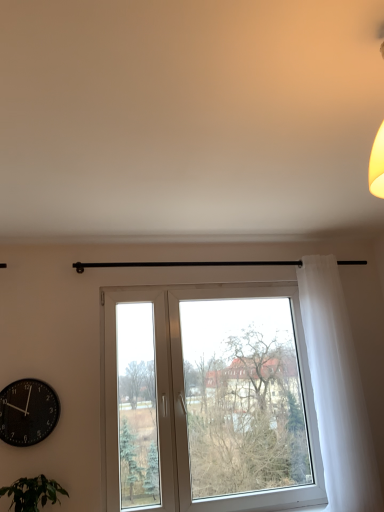
Question: Is white sheer curtain at right a part of white plastic window at center?

Choices:
 (A) yes
 (B) no

Answer: (B)

Question: From the image's perspective, would you say white plastic window at center is shown under white sheer curtain at right?

Choices:
 (A) yes
 (B) no

Answer: (A)

Question: Is white sheer curtain at right at the back of white plastic window at center?

Choices:
 (A) no
 (B) yes

Answer: (A)

Question: Is white plastic window at center facing towards white sheer curtain at right?

Choices:
 (A) yes
 (B) no

Answer: (A)

Question: Can you confirm if white plastic window at center is bigger than white sheer curtain at right?

Choices:
 (A) yes
 (B) no

Answer: (A)

Question: Is black matte wall clock at lower left bigger or smaller than white sheer curtain at right?

Choices:
 (A) small
 (B) big

Answer: (A)

Question: In the image, is black matte wall clock at lower left positioned in front of or behind white sheer curtain at right?

Choices:
 (A) behind
 (B) front

Answer: (B)

Question: Is point (38, 409) positioned closer to the camera than point (317, 392)?

Choices:
 (A) farther
 (B) closer

Answer: (B)

Question: From a real-world perspective, is black matte wall clock at lower left above or below white sheer curtain at right?

Choices:
 (A) above
 (B) below

Answer: (B)

Question: Is point (344, 355) positioned closer to the camera than point (54, 484)?

Choices:
 (A) closer
 (B) farther

Answer: (B)

Question: Is white sheer curtain at right in front of or behind green leafy plant at lower left in the image?

Choices:
 (A) front
 (B) behind

Answer: (B)

Question: In the image, is white sheer curtain at right on the left side or the right side of green leafy plant at lower left?

Choices:
 (A) right
 (B) left

Answer: (A)

Question: From the image's perspective, is white sheer curtain at right above or below green leafy plant at lower left?

Choices:
 (A) below
 (B) above

Answer: (B)

Question: Considering the positions of point (3, 403) and point (294, 296), is point (3, 403) closer or farther from the camera than point (294, 296)?

Choices:
 (A) closer
 (B) farther

Answer: (A)

Question: Considering the relative positions of black matte wall clock at lower left and white plastic window at center in the image provided, is black matte wall clock at lower left to the left or to the right of white plastic window at center?

Choices:
 (A) right
 (B) left

Answer: (B)